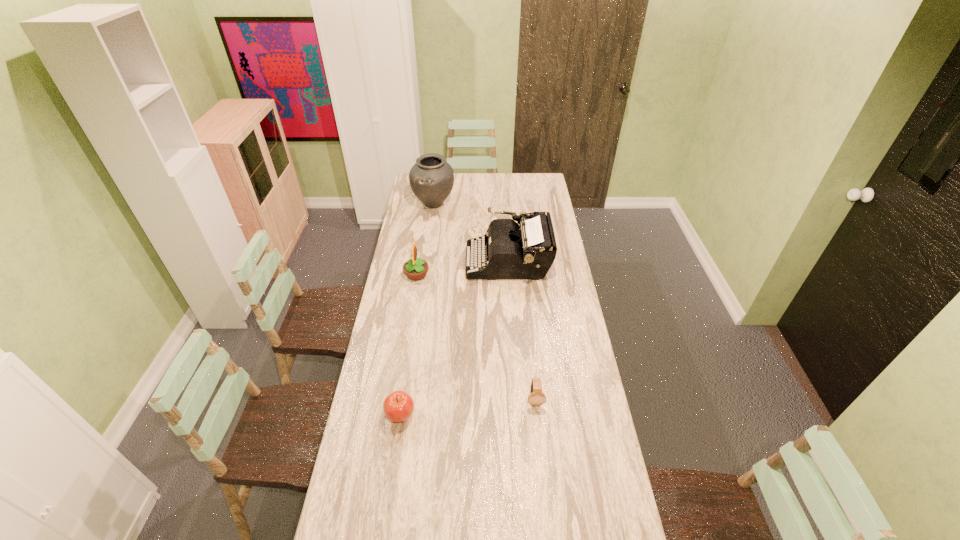
Locate an element on the screen. The image size is (960, 540). the farthest object is located at coordinates (431, 178).

You are a GUI agent. You are given a task and a screenshot of the screen. Output one action in this format:
    pyautogui.click(x=<x>, y=<y>)
    Task: Click on the tallest object
    This screenshot has width=960, height=540.
    Given the screenshot: What is the action you would take?
    pyautogui.click(x=431, y=178)

What are the coordinates of `typewriter` in the screenshot? It's located at (526, 249).

Find the location of a particular element. The width and height of the screenshot is (960, 540). sunflower is located at coordinates (415, 269).

At what (x,y) coordinates should I click in order to perform the action: click on watch. Please return your answer as a coordinate pair (x, y). Looking at the image, I should click on (536, 397).

The image size is (960, 540). I want to click on apple, so click(398, 406).

Where is `free space located 0.250m on the front of the tallest object`? The width and height of the screenshot is (960, 540). free space located 0.250m on the front of the tallest object is located at coordinates (428, 245).

The image size is (960, 540). I want to click on free space located 0.120m on the typing side of the typewriter, so click(x=443, y=261).

Where is `vacant space situated 0.090m on the typing side of the typewriter`? vacant space situated 0.090m on the typing side of the typewriter is located at coordinates (448, 261).

Locate an element on the screen. free region located 0.120m on the typing side of the typewriter is located at coordinates tap(443, 261).